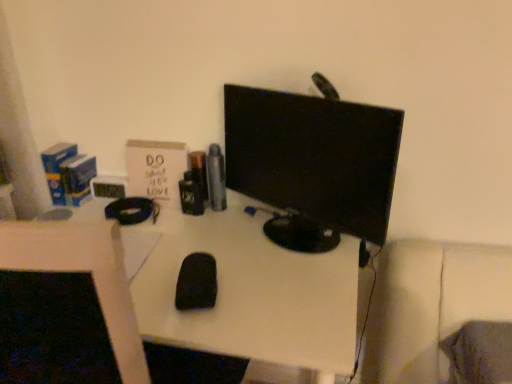
Locate an element on the screen. black glossy monitor at center is located at coordinates (314, 157).

You are a GUI agent. You are given a task and a screenshot of the screen. Output one action in this format:
    pyautogui.click(x=<x>, y=<y>)
    Task: Click on the black matte mouse at center
    The height and width of the screenshot is (384, 512).
    Given the screenshot: What is the action you would take?
    pyautogui.click(x=196, y=282)

Considering the points (398, 139) and (266, 342), which point is in front, point (398, 139) or point (266, 342)?

The point (266, 342) is closer.

Can you confirm if black glossy monitor at center is wider than black matte mouse at center?

In fact, black glossy monitor at center might be narrower than black matte mouse at center.

How far apart are black glossy monitor at center and black matte mouse at center?

They are 27.86 centimeters apart.

Between black matte mouse at center and black glossy monitor at center, which one has smaller width?

Thinner between the two is black glossy monitor at center.

Which is more to the left, black matte mouse at center or black glossy monitor at center?

black matte mouse at center.

In the scene shown: From the image's perspective, is black matte mouse at center over black glossy monitor at center?

No, from the image's perspective, black matte mouse at center is not over black glossy monitor at center.

Is black glossy monitor at center at the back of black matte mouse at center?

No, black matte mouse at center's orientation is not away from black glossy monitor at center.

Consider the image. Between black matte mouse at center and black glossy monitor at center, which one has more height?

With more height is black matte mouse at center.

From a real-world perspective, is black matte mouse at center positioned under black glossy monitor at center based on gravity?

Indeed, from a real-world perspective, black matte mouse at center is positioned beneath black glossy monitor at center.

Is point (196, 270) closer to camera compared to point (96, 250)?

No.

Where is `desk in front of the black matte mouse at center`? The height and width of the screenshot is (384, 512). desk in front of the black matte mouse at center is located at coordinates (166, 300).

Considering the relative positions of black matte mouse at center and black matte mouse at center in the image provided, is black matte mouse at center to the right of black matte mouse at center from the viewer's perspective?

Indeed, black matte mouse at center is positioned on the right side of black matte mouse at center.

What's the angular difference between black matte mouse at center and black matte mouse at center's facing directions?

14.8 degrees separate the facing orientations of black matte mouse at center and black matte mouse at center.

Is black matte mouse at center with black matte mouse at center?

black matte mouse at center is not next to black matte mouse at center, and they're not touching.

This screenshot has height=384, width=512. Identify the location of desk that is below the black matte mouse at center (from the image's perspective). (166, 300).

Considering the sizes of objects black matte mouse at center and black matte mouse at center in the image provided, who is thinner, black matte mouse at center or black matte mouse at center?

black matte mouse at center.

Does black glossy monitor at center lie behind black matte mouse at center?

No, the depth of black glossy monitor at center is less than that of black matte mouse at center.

Can you tell me how much black glossy monitor at center and black matte mouse at center differ in facing direction?

black glossy monitor at center and black matte mouse at center are facing 44 degrees away from each other.

Between point (360, 207) and point (197, 259), which one is positioned in front?

Positioned in front is point (360, 207).

Considering the sizes of objects black glossy monitor at center and black matte mouse at center in the image provided, who is taller, black glossy monitor at center or black matte mouse at center?

black glossy monitor at center.

This screenshot has width=512, height=384. Find the location of `desk in front of the black glossy monitor at center`. desk in front of the black glossy monitor at center is located at coordinates coord(166,300).

In the image, there is a black glossy monitor at center. Where is `mouse below it (from a real-world perspective)`? The width and height of the screenshot is (512, 384). mouse below it (from a real-world perspective) is located at coordinates (196, 282).

Looking at the image, which one is located further to black matte mouse at center, black glossy monitor at center or black matte mouse at center?

The object further to black matte mouse at center is black glossy monitor at center.

Which object lies nearer to the anchor point black glossy monitor at center, black matte mouse at center or black matte mouse at center?

black matte mouse at center.

Looking at the image, which one is located further to black matte mouse at center, black glossy monitor at center or black matte mouse at center?

The object further to black matte mouse at center is black glossy monitor at center.

Estimate the real-world distances between objects in this image. Which object is closer to black matte mouse at center, black matte mouse at center or black glossy monitor at center?

Among the two, black matte mouse at center is located nearer to black matte mouse at center.

Which object lies further to the anchor point black glossy monitor at center, black matte mouse at center or black matte mouse at center?

The object further to black glossy monitor at center is black matte mouse at center.

Which object lies further to the anchor point black matte mouse at center, black matte mouse at center or black glossy monitor at center?

black glossy monitor at center.

Image resolution: width=512 pixels, height=384 pixels. Find the location of `mouse between black glossy monitor at center and black matte mouse at center in the up-down direction`. mouse between black glossy monitor at center and black matte mouse at center in the up-down direction is located at coordinates point(196,282).